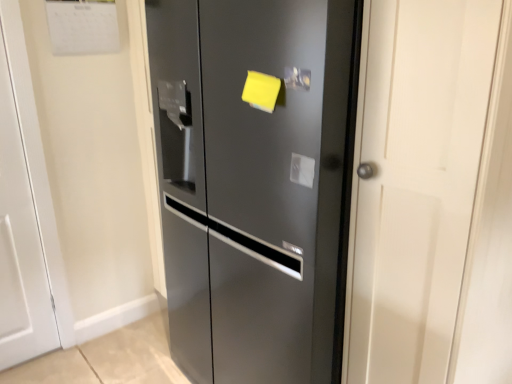
Question: From a real-world perspective, is satin black refrigerator at center, which ranks as the 2th door in left-to-right order, above or below white matte door at left, positioned as the 2th door in right-to-left order?

Choices:
 (A) above
 (B) below

Answer: (A)

Question: In terms of width, does satin black refrigerator at center, which is the first door in right-to-left order, look wider or thinner when compared to white matte door at left, positioned as the 2th door in right-to-left order?

Choices:
 (A) wide
 (B) thin

Answer: (A)

Question: Is satin black refrigerator at center, which ranks as the 2th door in left-to-right order, spatially inside white matte door at left, which is counted as the first door, starting from the left, or outside of it?

Choices:
 (A) outside
 (B) inside

Answer: (A)

Question: Is white matte door at left, positioned as the 2th door in right-to-left order, inside the boundaries of satin black refrigerator at center, which is the first door in right-to-left order, or outside?

Choices:
 (A) outside
 (B) inside

Answer: (A)

Question: Considering the relative positions of white matte door at left, positioned as the 2th door in right-to-left order, and satin black refrigerator at center, which is the first door in right-to-left order, in the image provided, is white matte door at left, positioned as the 2th door in right-to-left order, to the left or to the right of satin black refrigerator at center, which is the first door in right-to-left order,?

Choices:
 (A) left
 (B) right

Answer: (A)

Question: Is point (5, 236) positioned closer to the camera than point (309, 52)?

Choices:
 (A) closer
 (B) farther

Answer: (B)

Question: In terms of width, does white matte door at left, positioned as the 2th door in right-to-left order, look wider or thinner when compared to satin black refrigerator at center, which is the first door in right-to-left order?

Choices:
 (A) wide
 (B) thin

Answer: (B)